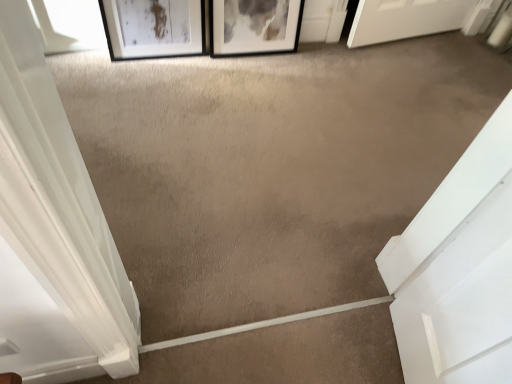
Question: Is point (76, 24) positioned closer to the camera than point (176, 49)?

Choices:
 (A) farther
 (B) closer

Answer: (B)

Question: Would you say transparent glass window at upper left is inside or outside matte black picture frame at upper left, acting as the second picture frame starting from the right?

Choices:
 (A) inside
 (B) outside

Answer: (B)

Question: Considering the real-world distances, which object is closest to the transparent glass window at upper left?

Choices:
 (A) black matte picture frame at upper center, the 2th picture frame from the left
 (B) matte black picture frame at upper left, which is the first picture frame in left-to-right order

Answer: (B)

Question: Which is farther from the transparent glass window at upper left?

Choices:
 (A) matte black picture frame at upper left, which is the first picture frame in left-to-right order
 (B) black matte picture frame at upper center, the 2th picture frame from the left

Answer: (B)